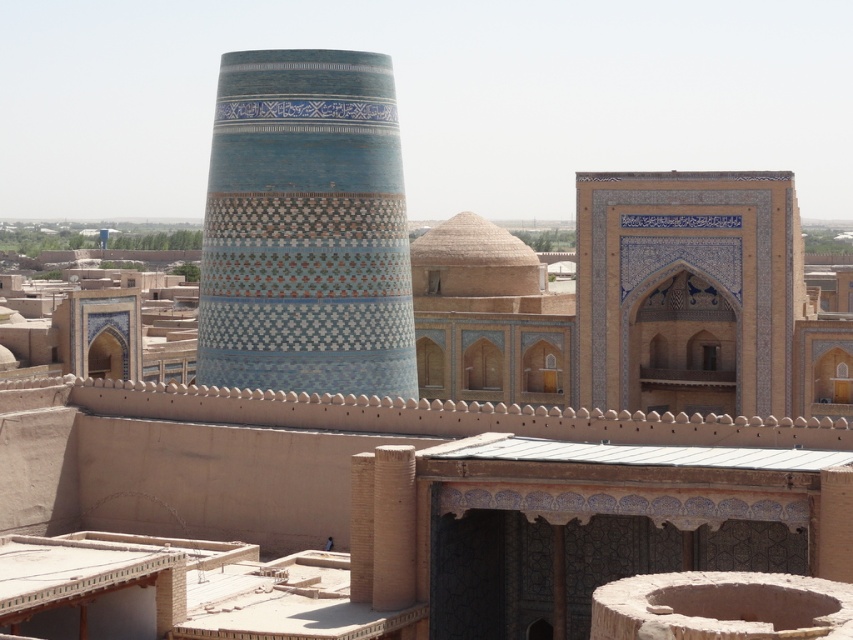
Question: Which point appears farthest from the camera in this image?

Choices:
 (A) (267, 115)
 (B) (618, 211)

Answer: (B)

Question: Does blue glazed tile tower at center have a larger size compared to blue glazed tile at center?

Choices:
 (A) no
 (B) yes

Answer: (A)

Question: Which point appears farthest from the camera in this image?

Choices:
 (A) (738, 364)
 (B) (212, 164)

Answer: (A)

Question: Does blue glazed tile tower at center appear under blue glazed tile at center?

Choices:
 (A) yes
 (B) no

Answer: (B)

Question: Is blue glazed tile tower at center to the right of blue glazed tile at center from the viewer's perspective?

Choices:
 (A) no
 (B) yes

Answer: (A)